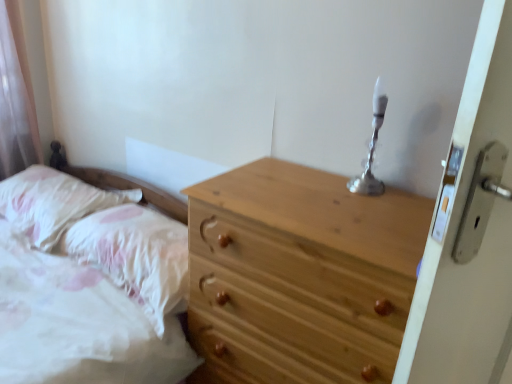
Identify the location of empty space that is ontop of natural wood chest of drawers at center (from a real-world perspective). Image resolution: width=512 pixels, height=384 pixels. (316, 193).